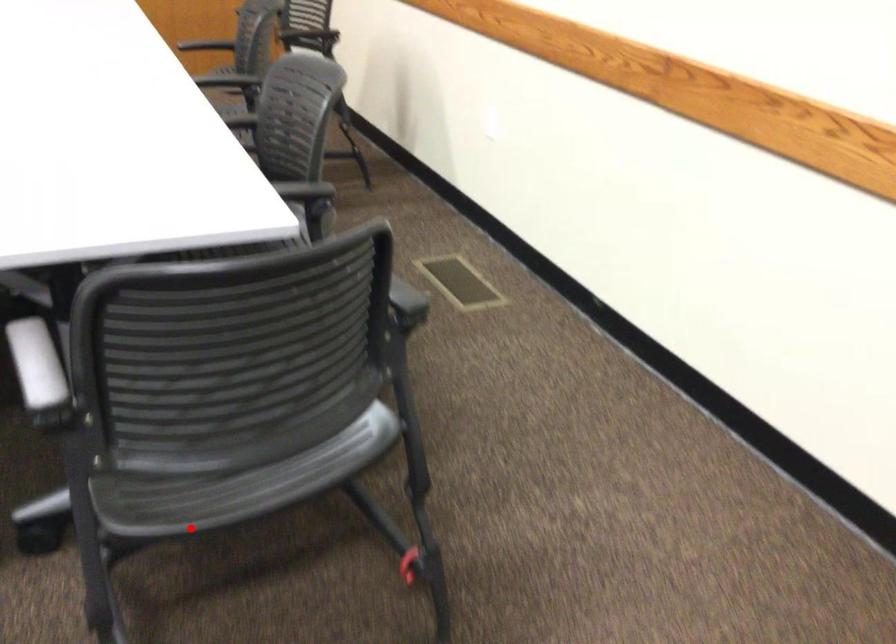
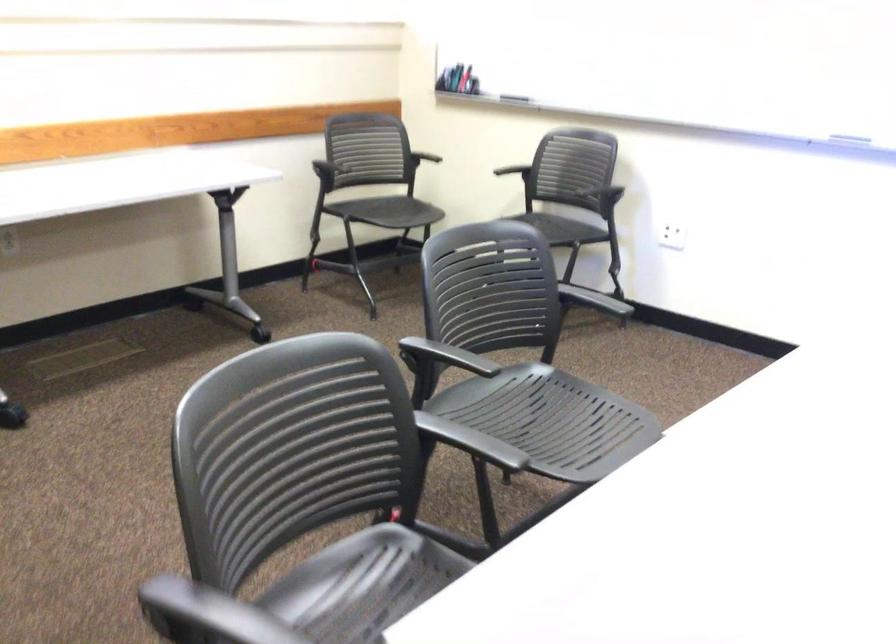
Question: I am providing you with two images of the same scene from different viewpoints. Image1 has a red point marked. In image2, the corresponding 3D location appears at what relative position? Reply with the corresponding letter.

Choices:
 (A) Closer
 (B) Farther

Answer: (B)